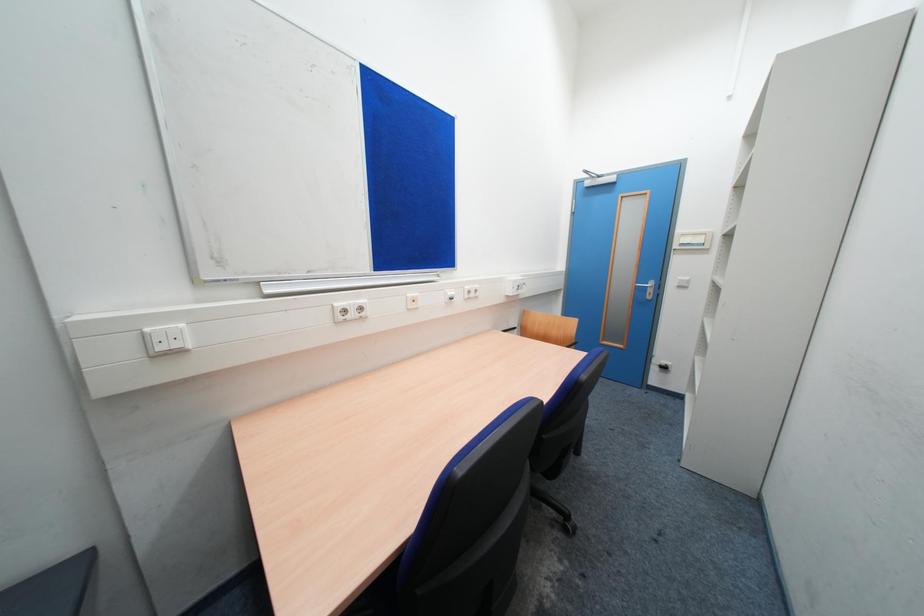
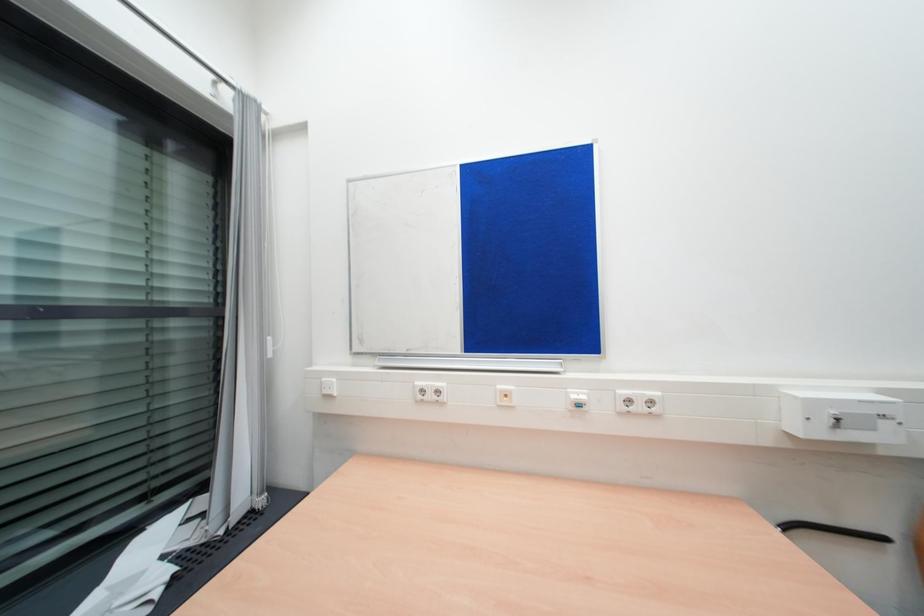
Question: The camera is either moving clockwise (left) or counter-clockwise (right) around the object. The first image is from the beginning of the video and the second image is from the end. Is the camera moving left or right when shooting the video?

Choices:
 (A) Left
 (B) Right

Answer: (B)